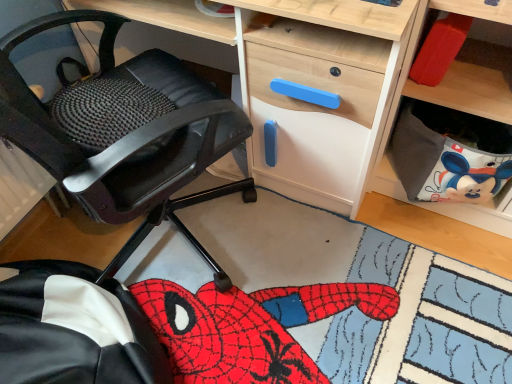
Question: Considering the positions of gray fabric bag at lower right and wooden desk at center in the image, is gray fabric bag at lower right wider or thinner than wooden desk at center?

Choices:
 (A) wide
 (B) thin

Answer: (B)

Question: Looking at the image, does gray fabric bag at lower right seem bigger or smaller compared to wooden desk at center?

Choices:
 (A) small
 (B) big

Answer: (A)

Question: Estimate the real-world distances between objects in this image. Which object is closer to the gray fabric bag at lower right?

Choices:
 (A) wooden desk at center
 (B) black leather chair at left

Answer: (A)

Question: Which object is the farthest from the wooden desk at center?

Choices:
 (A) gray fabric bag at lower right
 (B) black leather chair at left

Answer: (B)